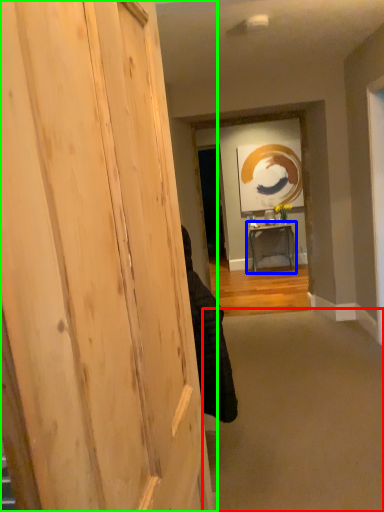
Question: Considering the real-world distances, which object is farthest from plain (highlighted by a red box)? table (highlighted by a blue box) or door (highlighted by a green box)?

Choices:
 (A) table
 (B) door

Answer: (A)